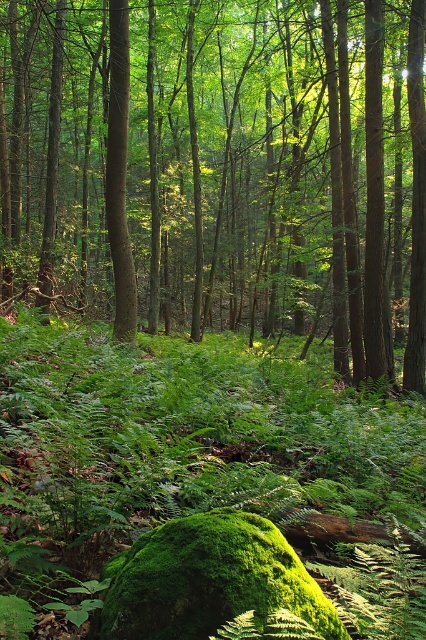
Locate an element on the screen. This screenshot has height=640, width=426. green leafy tree at center is located at coordinates (219, 168).

Who is higher up, green leafy tree at center or green matte tree trunk at center?

green leafy tree at center is above.

Image resolution: width=426 pixels, height=640 pixels. What do you see at coordinates (219, 168) in the screenshot?
I see `green leafy tree at center` at bounding box center [219, 168].

The height and width of the screenshot is (640, 426). I want to click on green leafy tree at center, so click(x=219, y=168).